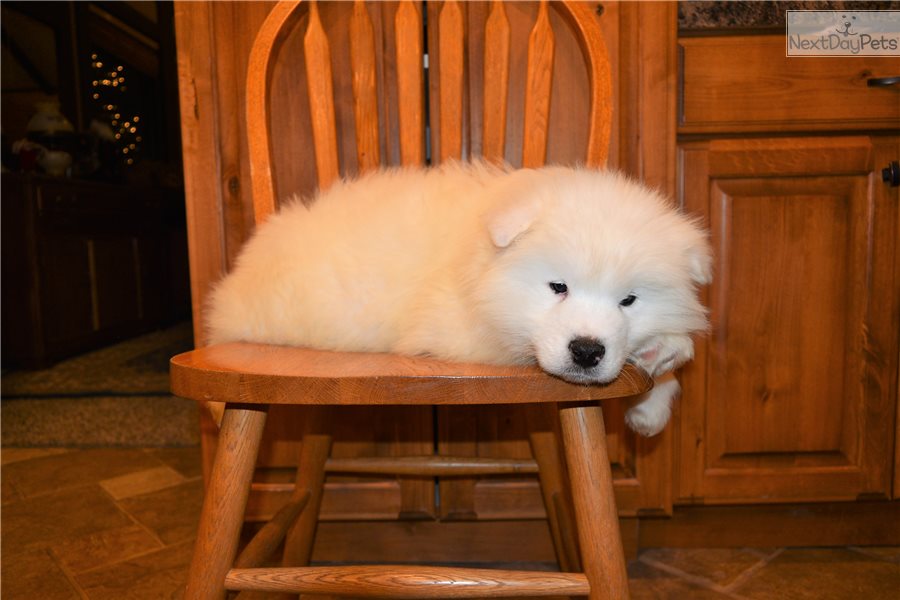
Locate an element on the screen. floor strip between rooms is located at coordinates click(112, 393).